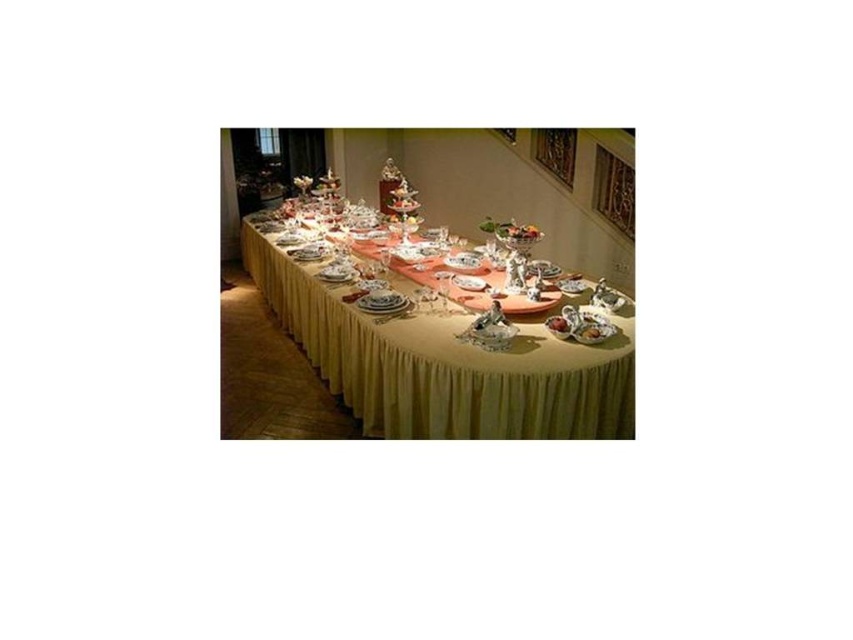
From the picture: You are a guest at a formal dinner and notice the yellow fabric tablecloth at center and the white porcelain plate at center. From your seat at the table, which object is positioned to the right of the other?

The yellow fabric tablecloth at center is to the right of the white porcelain plate at center.

You are standing at the end of the dining table and want to place a napkin between the two points marked as point (303, 282) and point (550, 324). Which point is closer to you so you can start placing the napkin there first?

Point (303, 282) is closer to you than point (550, 324), so you should start placing the napkin near point (303, 282) first.

You are a guest at a formal dinner seated at the dining table. You notice the white porcelain platter at center and the smooth pink cake at center. Which item is closer to your perspective as you look at the table?

The white porcelain platter at center is closer to your perspective because it is further to the viewer than the smooth pink cake at center.